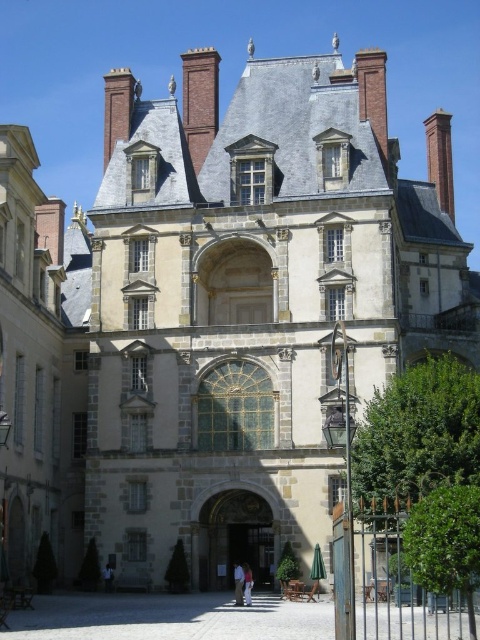
You are standing in front of the smooth stone mansion at center and the white cotton shirt at center in the image. Which object is closer to you?

The smooth stone mansion at center is closer to you because the white cotton shirt at center is behind it.

You are a tour guide explaining the exterior of the building to visitors. You mention both the smooth stone mansion at center and the brown wooden door at center. Which of these two objects is bigger?

The smooth stone mansion at center is larger in size than the brown wooden door at center.

Based on the scene description, what does the point at coordinates (253, 292) represent?

The point at coordinates (253, 292) indicates the location of the smooth stone mansion at center.